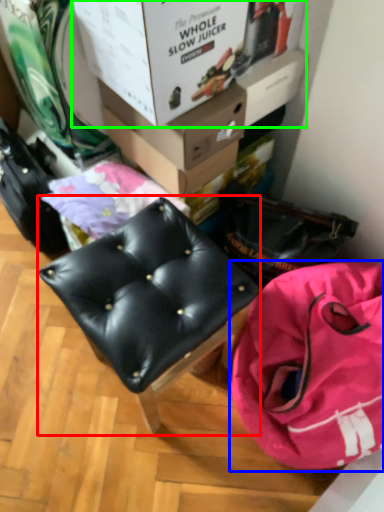
Question: Considering the real-world distances, which object is farthest from furniture (highlighted by a red box)? handbag (highlighted by a blue box) or box (highlighted by a green box)?

Choices:
 (A) handbag
 (B) box

Answer: (B)